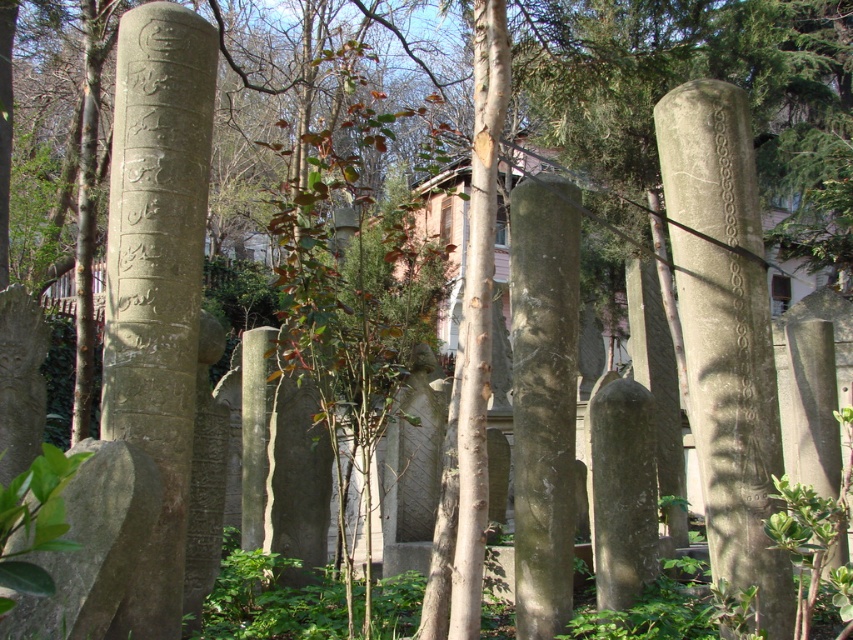
Between point (187, 259) and point (743, 289), which one is positioned behind?

Point (187, 259)

The height and width of the screenshot is (640, 853). In order to click on gray stone pillar at center in this screenshot , I will do `click(157, 280)`.

Image resolution: width=853 pixels, height=640 pixels. In order to click on gray stone pillar at center in this screenshot , I will do `click(157, 280)`.

Can you confirm if gray stone pillar at center is positioned above smooth brown tree trunk at center?

Yes, gray stone pillar at center is above smooth brown tree trunk at center.

Who is more forward, (161, 189) or (469, 570)?

Positioned in front is point (469, 570).

Image resolution: width=853 pixels, height=640 pixels. What are the coordinates of `gray stone pillar at center` in the screenshot? It's located at (157, 280).

This screenshot has height=640, width=853. Describe the element at coordinates (724, 333) in the screenshot. I see `gray stone column at center` at that location.

Is gray stone column at center below smooth brown tree trunk at center?

Actually, gray stone column at center is above smooth brown tree trunk at center.

Between point (741, 200) and point (467, 564), which one is positioned behind?

The point (741, 200) is more distant.

Where is `gray stone column at center`? gray stone column at center is located at coordinates (724, 333).